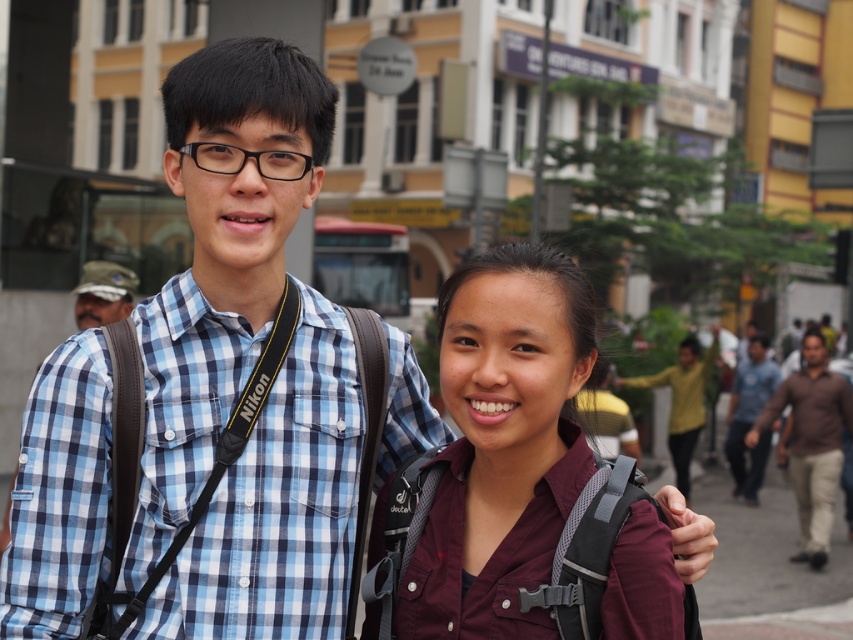
Based on the photo, which is more to the right, blue checkered shirt at center or brown cotton shirt at right?

Positioned to the right is brown cotton shirt at right.

Between point (213, 92) and point (813, 550), which one is positioned in front?

Point (213, 92)

Image resolution: width=853 pixels, height=640 pixels. What do you see at coordinates (245, 365) in the screenshot?
I see `blue checkered shirt at center` at bounding box center [245, 365].

Where is `blue checkered shirt at center`? The image size is (853, 640). blue checkered shirt at center is located at coordinates [x=245, y=365].

Is yellow matte shirt at center thinner than camouflage fabric hat at left?

No.

Who is more forward, (x=692, y=438) or (x=102, y=289)?

Point (x=102, y=289) is more forward.

Identify the location of yellow matte shirt at center. (682, 401).

Where is `yellow matte shirt at center`? The image size is (853, 640). yellow matte shirt at center is located at coordinates (682, 401).

Who is more forward, (x=666, y=380) or (x=747, y=502)?

Positioned in front is point (x=747, y=502).

At what (x,y) coordinates should I click in order to perform the action: click on yellow matte shirt at center. Please return your answer as a coordinate pair (x, y). Image resolution: width=853 pixels, height=640 pixels. Looking at the image, I should click on (682, 401).